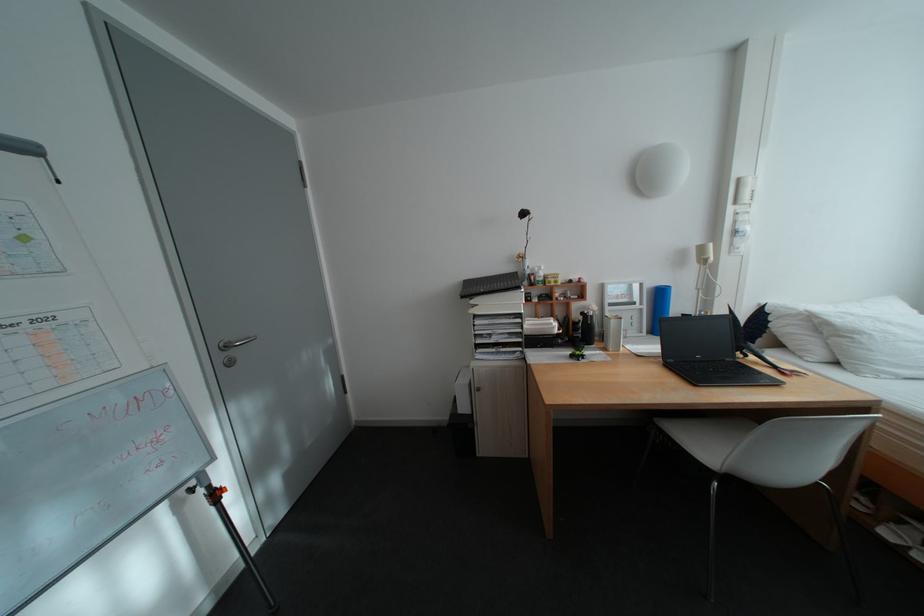
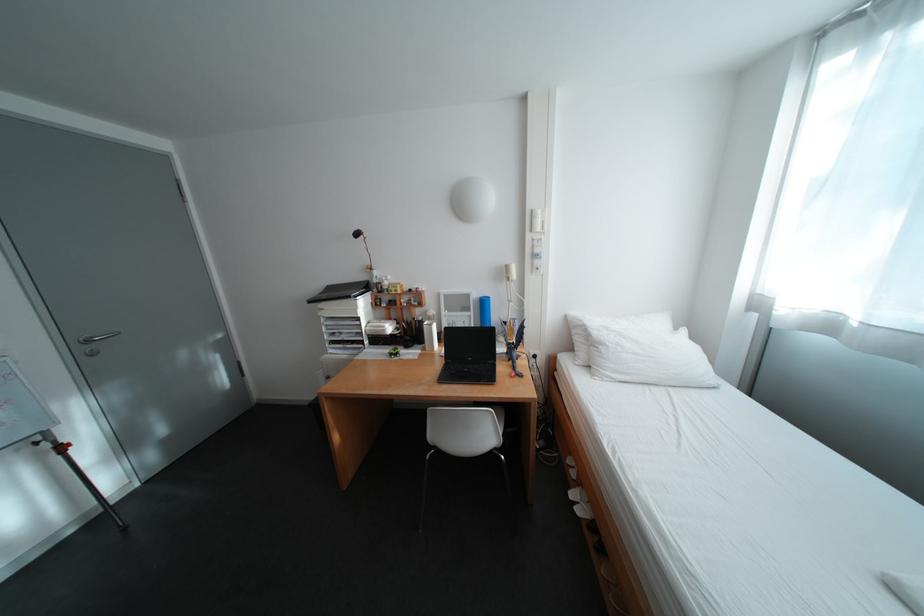
The point at (237, 349) is marked in the first image. Where is the corresponding point in the second image?

(100, 342)